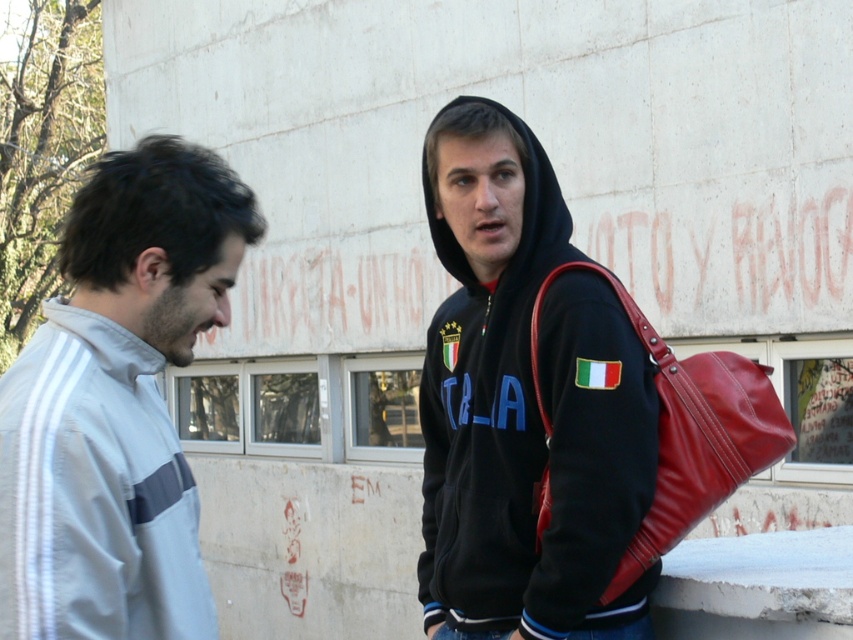
Can you confirm if black fleece hoodie at center is positioned to the left of light gray fabric jacket at left?

Incorrect, black fleece hoodie at center is not on the left side of light gray fabric jacket at left.

Between black fleece hoodie at center and light gray fabric jacket at left, which one has less height?

Standing shorter between the two is light gray fabric jacket at left.

Which is in front, point (462, 330) or point (67, 484)?

Positioned in front is point (67, 484).

At what (x,y) coordinates should I click in order to perform the action: click on black fleece hoodie at center. Please return your answer as a coordinate pair (x, y). The image size is (853, 640). Looking at the image, I should click on (524, 403).

Does light gray fabric jacket at left have a greater height compared to leather-like red bag at right?

Correct, light gray fabric jacket at left is much taller as leather-like red bag at right.

Between point (148, 346) and point (677, 531), which one is positioned behind?

The point (677, 531) is more distant.

Find the location of a particular element. The width and height of the screenshot is (853, 640). light gray fabric jacket at left is located at coordinates (117, 404).

Does point (505, 355) come behind point (741, 355)?

No, it is in front of (741, 355).

Describe the element at coordinates (524, 403) in the screenshot. The image size is (853, 640). I see `black fleece hoodie at center` at that location.

Where is `black fleece hoodie at center`? black fleece hoodie at center is located at coordinates (524, 403).